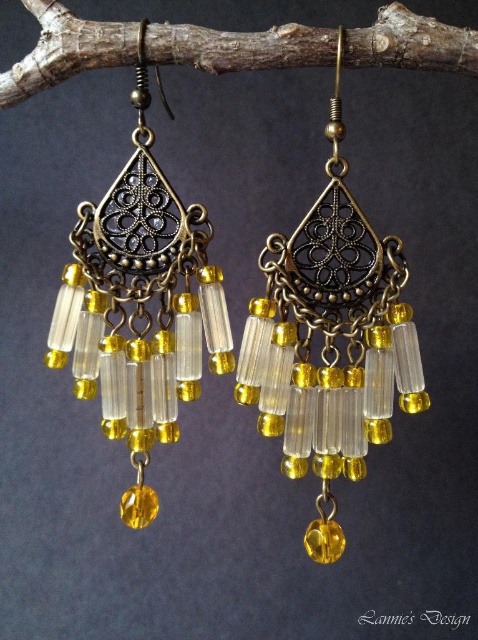
Which is in front, point (336, 524) or point (292, 26)?

Point (292, 26)

Does antique brass earrings at center have a larger size compared to brown wood at upper center?

Yes, antique brass earrings at center is bigger than brown wood at upper center.

Find the location of `antique brass earrings at center`. antique brass earrings at center is located at coordinates (330, 340).

The width and height of the screenshot is (478, 640). Find the location of `antique brass earrings at center`. antique brass earrings at center is located at coordinates (330, 340).

Which is in front, point (116, 230) or point (455, 49)?

Positioned in front is point (455, 49).

Find the location of a particular element. This screenshot has width=478, height=640. antique gold metal chandelier earrings at center is located at coordinates (140, 305).

Where is `antique gold metal chandelier earrings at center`? The width and height of the screenshot is (478, 640). antique gold metal chandelier earrings at center is located at coordinates (140, 305).

Consider the image. Does antique brass earrings at center have a smaller size compared to antique gold metal chandelier earrings at center?

No, antique brass earrings at center is not smaller than antique gold metal chandelier earrings at center.

From the picture: Who is more forward, (381, 314) or (149, 248)?

Point (381, 314) is more forward.

The height and width of the screenshot is (640, 478). I want to click on antique brass earrings at center, so click(x=330, y=340).